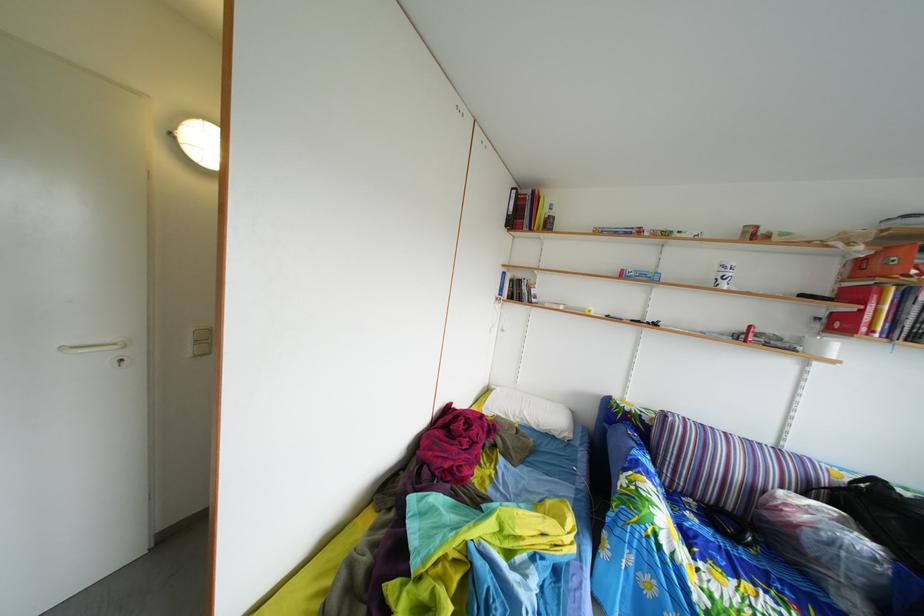
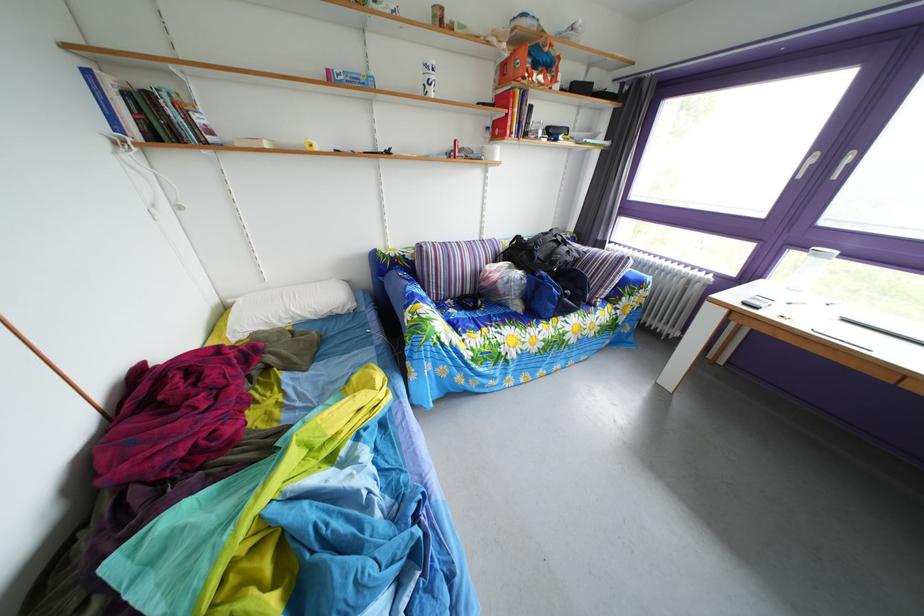
Locate, in the second image, the point that corresponds to point (531, 421) in the first image.

(298, 320)